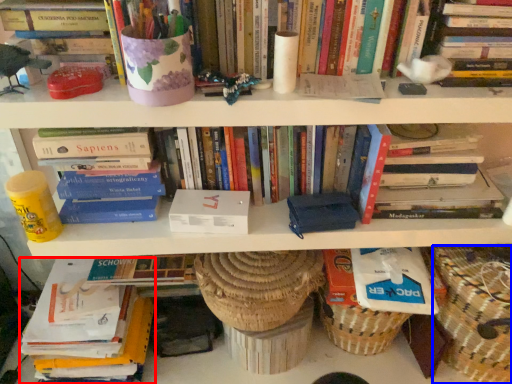
Question: Among these objects, which one is nearest to the camera, book (highlighted by a red box) or basket (highlighted by a blue box)?

Choices:
 (A) book
 (B) basket

Answer: (B)